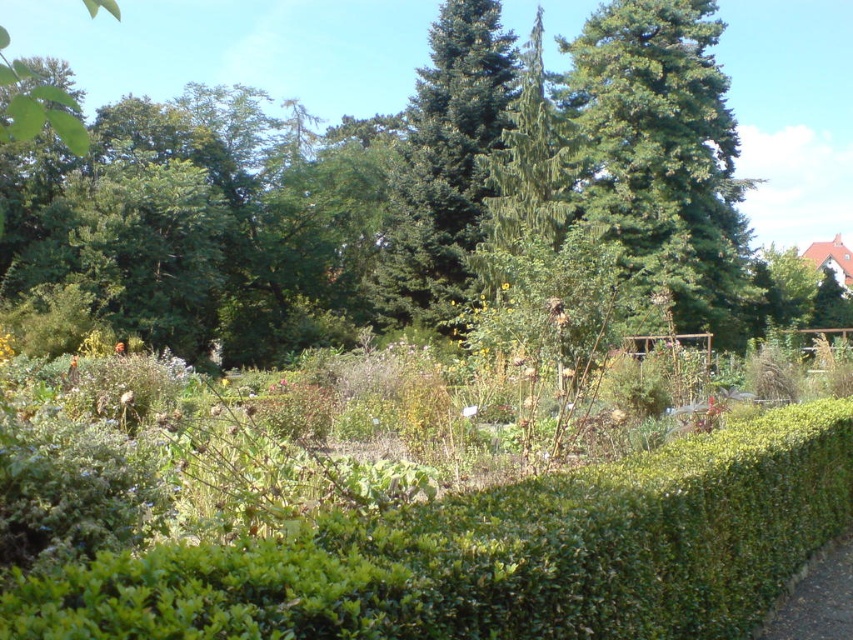
Question: Can you confirm if green leafy hedge at lower right is positioned to the right of green needle-like at upper center?

Choices:
 (A) no
 (B) yes

Answer: (A)

Question: Which point is closer to the camera taking this photo?

Choices:
 (A) (425, 244)
 (B) (190, 593)
 (C) (764, 637)
 (D) (737, 145)

Answer: (B)

Question: Does green needle-like at upper center appear on the right side of dirt path at lower right?

Choices:
 (A) no
 (B) yes

Answer: (B)

Question: Which point is closer to the camera?

Choices:
 (A) (466, 179)
 (B) (592, 24)
 (C) (851, 588)
 (D) (138, 604)

Answer: (D)

Question: Is green leafy hedge at lower right below green needle-like at center?

Choices:
 (A) no
 (B) yes

Answer: (B)

Question: Which is farther from the dirt path at lower right?

Choices:
 (A) green needle-like at upper center
 (B) green leafy hedge at lower right
 (C) green needle-like at center

Answer: (C)